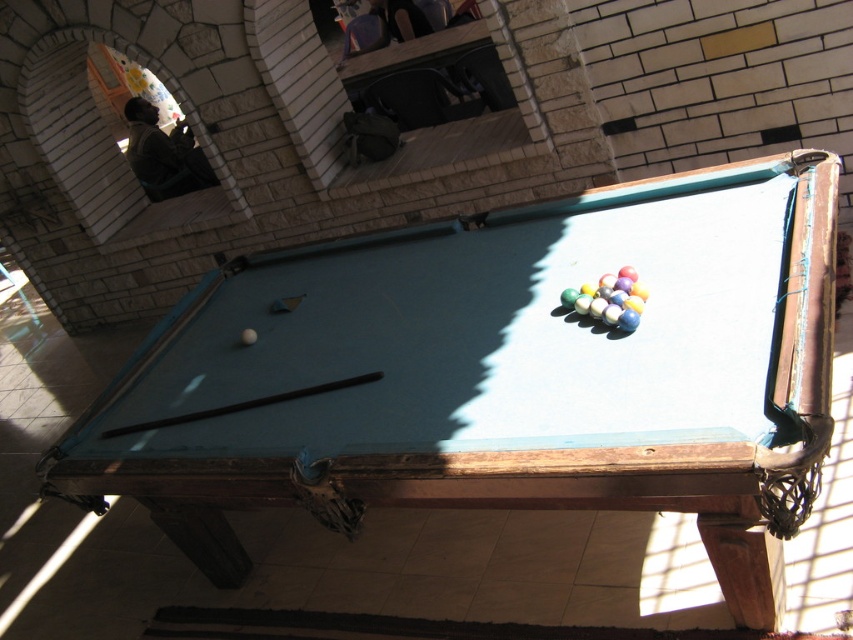
Is blue felt pool table at center above brown wood cue at center?

Indeed, blue felt pool table at center is positioned over brown wood cue at center.

Is point (508, 385) in front of point (233, 410)?

Yes, point (508, 385) is closer to viewer.

Describe the element at coordinates (502, 376) in the screenshot. This screenshot has width=853, height=640. I see `blue felt pool table at center` at that location.

Where is `blue felt pool table at center`? This screenshot has height=640, width=853. blue felt pool table at center is located at coordinates (502, 376).